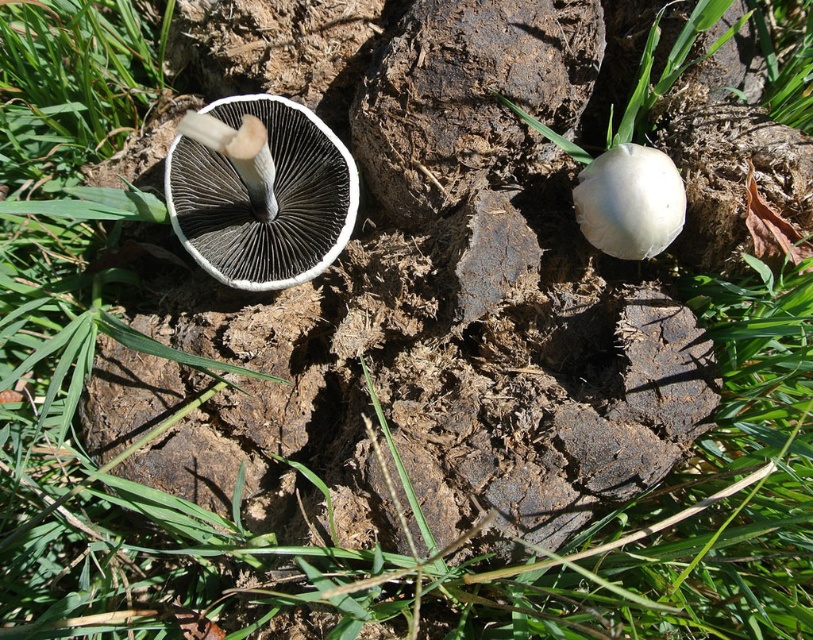
You are a photographer trying to capture both the white matte mushroom at center and the white matte mushroom at right in a single shot. Based on their positions, which mushroom will appear closer to the camera in the photo?

The white matte mushroom at center will appear closer to the camera because it is positioned in front of the white matte mushroom at right.